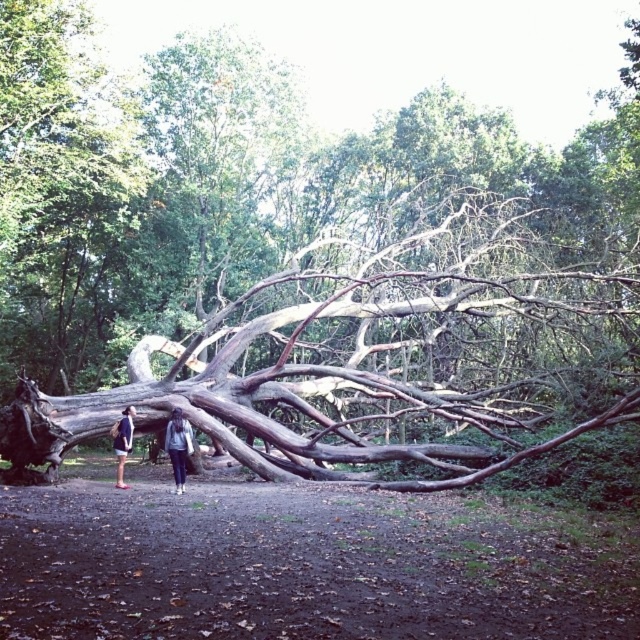
Question: Can you confirm if denim jacket at center is positioned to the left of denim shorts at lower left?

Choices:
 (A) yes
 (B) no

Answer: (B)

Question: Is brown dirt path at lower center in front of denim jacket at center?

Choices:
 (A) yes
 (B) no

Answer: (A)

Question: Which of the following is the farthest from the observer?

Choices:
 (A) brown dirt path at lower center
 (B) denim shorts at lower left

Answer: (B)

Question: Which object appears closest to the camera in this image?

Choices:
 (A) denim jacket at center
 (B) denim shorts at lower left

Answer: (A)

Question: Can you confirm if brown dirt path at lower center is wider than denim shorts at lower left?

Choices:
 (A) yes
 (B) no

Answer: (A)

Question: Which object is farther from the camera taking this photo?

Choices:
 (A) denim jacket at center
 (B) brown dirt path at lower center

Answer: (A)